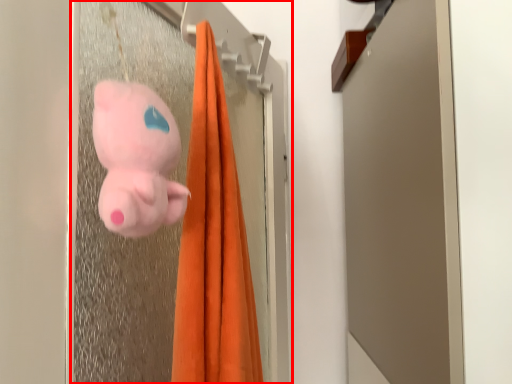
Question: In this image, where is screen door (annotated by the red box) located relative to toy?

Choices:
 (A) left
 (B) right

Answer: (B)